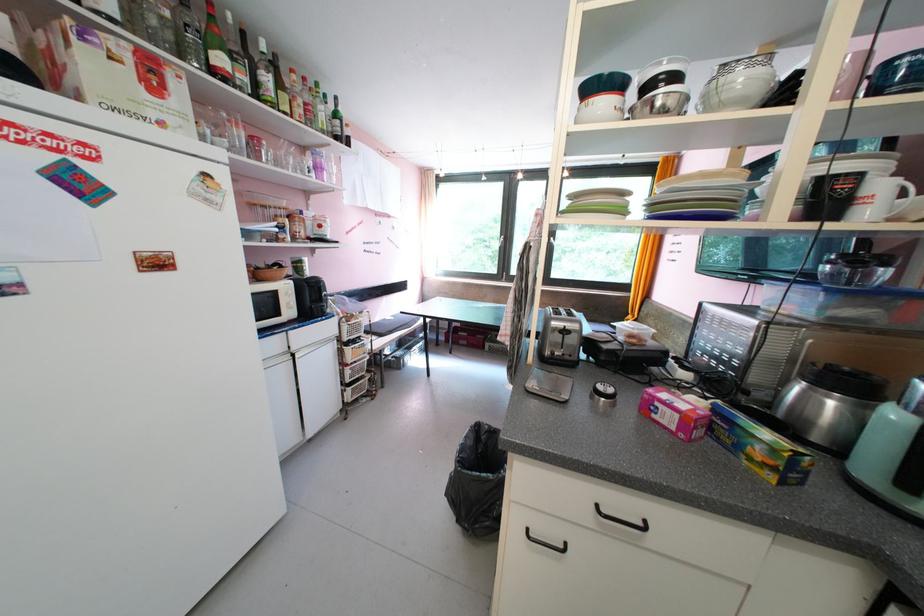
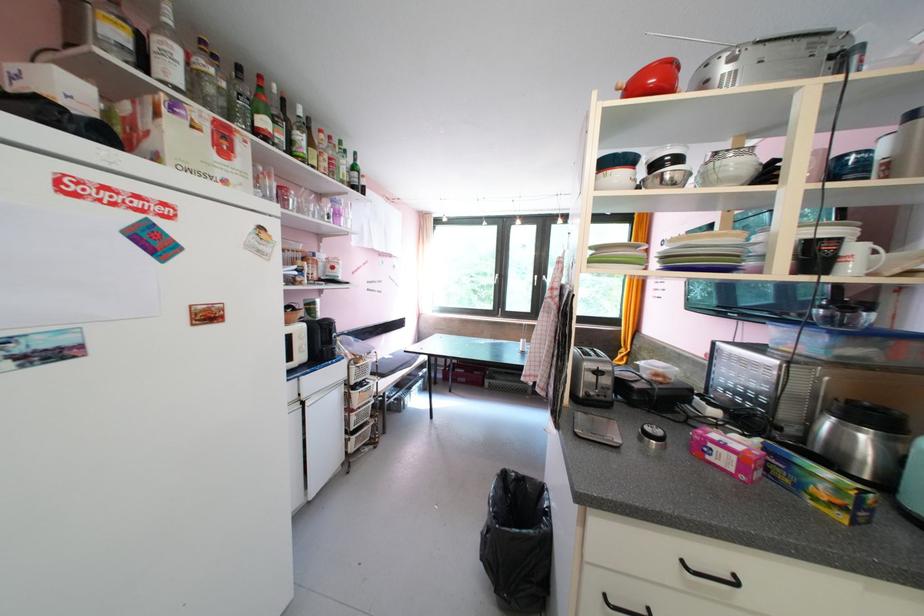
Locate, in the second image, the point that corresponds to (x=228, y=62) in the first image.

(273, 124)